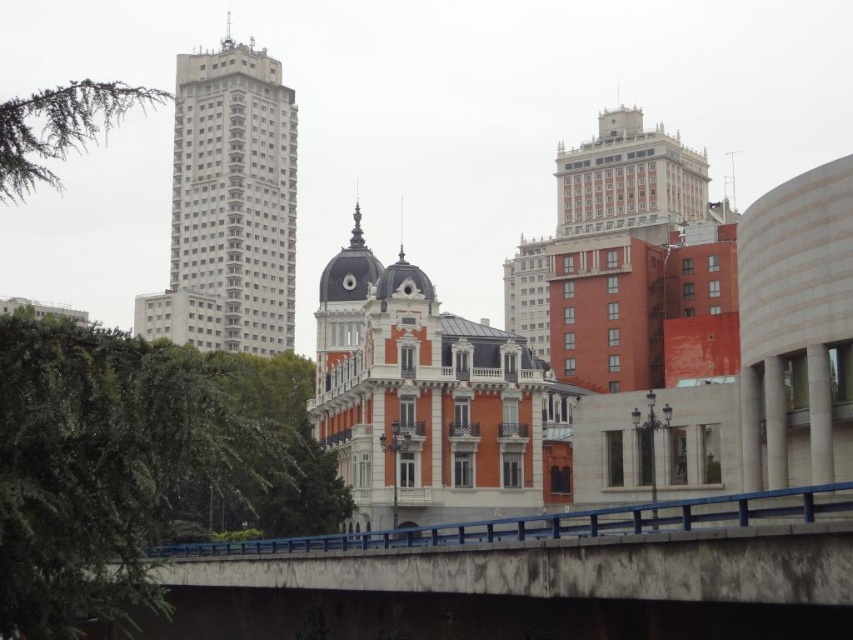
You are standing at the point marked by coordinates point (x=537, y=577) in the cityscape. What object are you currently standing on?

The point (x=537, y=577) corresponds to the blue concrete bridge at lower center, so you are standing on the blue concrete bridge at lower center.

You are a delivery driver who needs to cross the blue concrete bridge at lower center with a truck that is 3 meters wide. The green leafy tree at lower left is blocking your path. Can you safely pass through the bridge without damaging the tree or your truck?

The blue concrete bridge at lower center is wider than the green leafy tree at lower left, so the truck can safely pass through the bridge as long as it stays centered and avoids the tree.

You are taking a photo of the cityscape and want to ensure both the bridge with blue railing and the classical European building are in focus. Which point, point 1 at coordinates (x=286, y=401) or point 2 at coordinates (x=149, y=104), should you focus on to make sure both are sharp?

You should focus on point 1 at coordinates (x=286, y=401) because it is closer to the camera than point 2 at coordinates (x=149, y=104). By focusing on the closer point, the depth of field will extend to include the farther point, ensuring both the bridge and the classical European building are in focus.